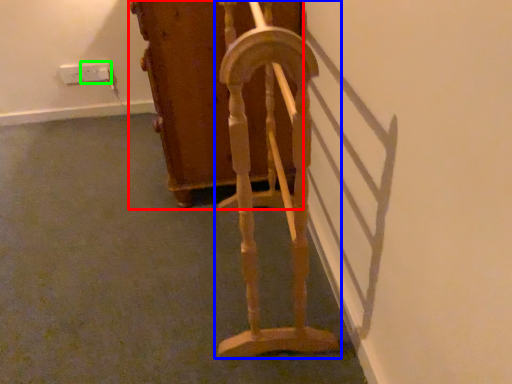
Question: Which object is positioned farthest from furniture (highlighted by a red box)? Select from furniture (highlighted by a blue box) and electric outlet (highlighted by a green box).

Choices:
 (A) furniture
 (B) electric outlet

Answer: (B)